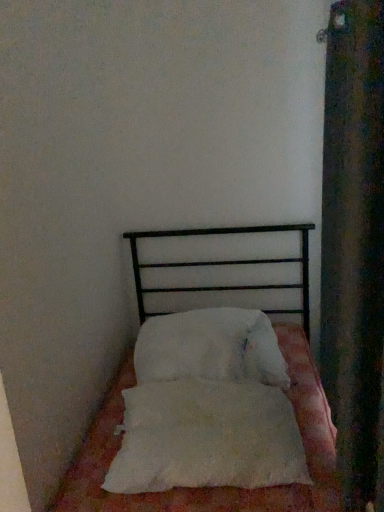
Question: Is white fluffy pillow at center, which ranks as the first pillow in back-to-front order, positioned beyond the bounds of white fluffy pillow at center, which is counted as the first pillow, starting from the front?

Choices:
 (A) no
 (B) yes

Answer: (B)

Question: Is white fluffy pillow at center, arranged as the second pillow when viewed from the front, in front of white fluffy pillow at center, positioned as the second pillow in back-to-front order?

Choices:
 (A) no
 (B) yes

Answer: (A)

Question: Can you confirm if white fluffy pillow at center, arranged as the second pillow when viewed from the front, is taller than white fluffy pillow at center, positioned as the second pillow in back-to-front order?

Choices:
 (A) no
 (B) yes

Answer: (B)

Question: Can you confirm if white fluffy pillow at center, arranged as the second pillow when viewed from the front, is wider than white fluffy pillow at center, which is counted as the first pillow, starting from the front?

Choices:
 (A) no
 (B) yes

Answer: (B)

Question: Does white fluffy pillow at center, which ranks as the first pillow in back-to-front order, appear on the left side of white fluffy pillow at center, which is counted as the first pillow, starting from the front?

Choices:
 (A) no
 (B) yes

Answer: (A)

Question: Does point (140, 264) appear closer or farther from the camera than point (193, 318)?

Choices:
 (A) closer
 (B) farther

Answer: (B)

Question: From their relative heights in the image, would you say white soft bed at center is taller or shorter than white fluffy pillow at center, which ranks as the first pillow in back-to-front order?

Choices:
 (A) short
 (B) tall

Answer: (B)

Question: Considering their positions, is white soft bed at center located in front of or behind white fluffy pillow at center, which ranks as the first pillow in back-to-front order?

Choices:
 (A) behind
 (B) front

Answer: (B)

Question: Choose the correct answer: Is white soft bed at center inside white fluffy pillow at center, arranged as the second pillow when viewed from the front, or outside it?

Choices:
 (A) inside
 (B) outside

Answer: (B)

Question: From their relative heights in the image, would you say velvet dark green curtain at right is taller or shorter than white fluffy pillow at center, positioned as the second pillow in back-to-front order?

Choices:
 (A) short
 (B) tall

Answer: (B)

Question: In terms of size, does velvet dark green curtain at right appear bigger or smaller than white fluffy pillow at center, which is counted as the first pillow, starting from the front?

Choices:
 (A) small
 (B) big

Answer: (B)

Question: From the image's perspective, relative to white fluffy pillow at center, positioned as the second pillow in back-to-front order, is velvet dark green curtain at right above or below?

Choices:
 (A) below
 (B) above

Answer: (B)

Question: Considering the positions of velvet dark green curtain at right and white fluffy pillow at center, which is counted as the first pillow, starting from the front, in the image, is velvet dark green curtain at right wider or thinner than white fluffy pillow at center, which is counted as the first pillow, starting from the front,?

Choices:
 (A) thin
 (B) wide

Answer: (A)

Question: From the image's perspective, is white soft bed at center located above or below white fluffy pillow at center, positioned as the second pillow in back-to-front order?

Choices:
 (A) below
 (B) above

Answer: (B)

Question: Is white soft bed at center taller or shorter than white fluffy pillow at center, which is counted as the first pillow, starting from the front?

Choices:
 (A) tall
 (B) short

Answer: (A)